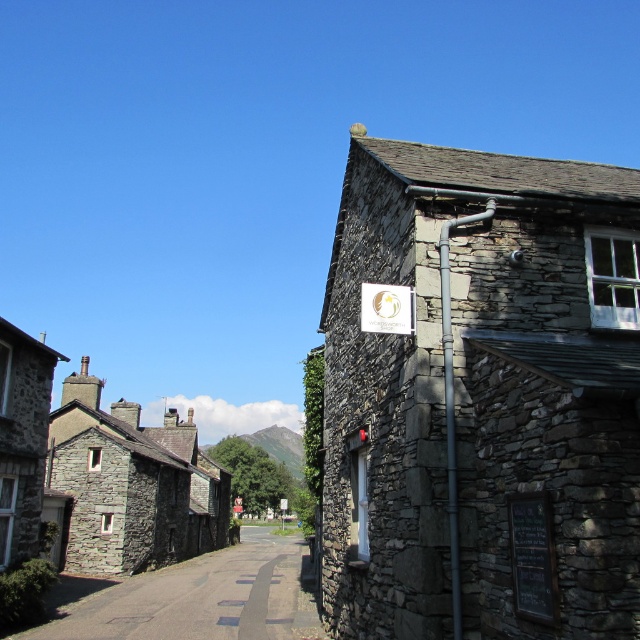
Can you confirm if gray stone building at upper right is positioned to the right of stone wall at center?

Indeed, gray stone building at upper right is positioned on the right side of stone wall at center.

Between gray stone building at upper right and stone wall at center, which one is positioned higher?

gray stone building at upper right is higher up.

Is point (545, 484) behind point (291, 564)?

No, (545, 484) is closer to viewer.

Where is `gray stone building at upper right`? The width and height of the screenshot is (640, 640). gray stone building at upper right is located at coordinates (483, 397).

Does stone wall at center have a smaller size compared to white paper sign at upper center?

Actually, stone wall at center might be larger than white paper sign at upper center.

Does point (256, 618) come behind point (394, 288)?

That is True.

You are a GUI agent. You are given a task and a screenshot of the screen. Output one action in this format:
    pyautogui.click(x=<x>, y=<y>)
    Task: Click on the stone wall at center
    
    Given the screenshot: What is the action you would take?
    pyautogui.click(x=202, y=598)

Measure the distance between point (381, 298) and camera.

Point (381, 298) and camera are 32.39 feet apart.

What do you see at coordinates (387, 308) in the screenshot?
I see `white paper sign at upper center` at bounding box center [387, 308].

Between point (412, 326) and point (282, 506), which one is positioned in front?

Point (412, 326) is more forward.

Identify the location of white paper sign at upper center. (387, 308).